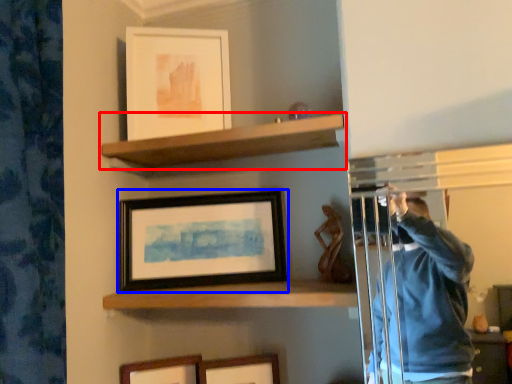
Question: Which object appears closest to the camera in this image, shelf (highlighted by a red box) or picture frame (highlighted by a blue box)?

Choices:
 (A) shelf
 (B) picture frame

Answer: (A)